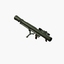
At what (x,y) coordinates should I click in order to perform the action: click on handle. Please return your answer as a coordinate pair (x, y). Looking at the image, I should click on (27, 35), (36, 36), (46, 40).